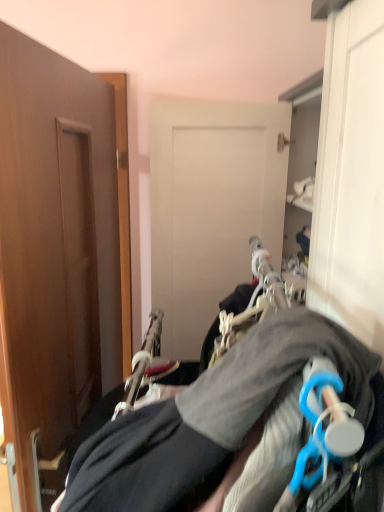
Question: From a real-world perspective, relative to gray fabric hanger at center, is brown wood door at left vertically above or below?

Choices:
 (A) above
 (B) below

Answer: (A)

Question: Is brown wood door at left spatially inside gray fabric hanger at center, or outside of it?

Choices:
 (A) inside
 (B) outside

Answer: (B)

Question: From the image's perspective, is brown wood door at left positioned above or below gray fabric hanger at center?

Choices:
 (A) below
 (B) above

Answer: (B)

Question: Considering the positions of point (307, 330) and point (114, 313), is point (307, 330) closer or farther from the camera than point (114, 313)?

Choices:
 (A) farther
 (B) closer

Answer: (B)

Question: Is gray fabric hanger at center to the left or to the right of brown wood door at left in the image?

Choices:
 (A) left
 (B) right

Answer: (B)

Question: Is gray fabric hanger at center wider or thinner than brown wood door at left?

Choices:
 (A) thin
 (B) wide

Answer: (B)

Question: Is gray fabric hanger at center bigger or smaller than brown wood door at left?

Choices:
 (A) small
 (B) big

Answer: (B)